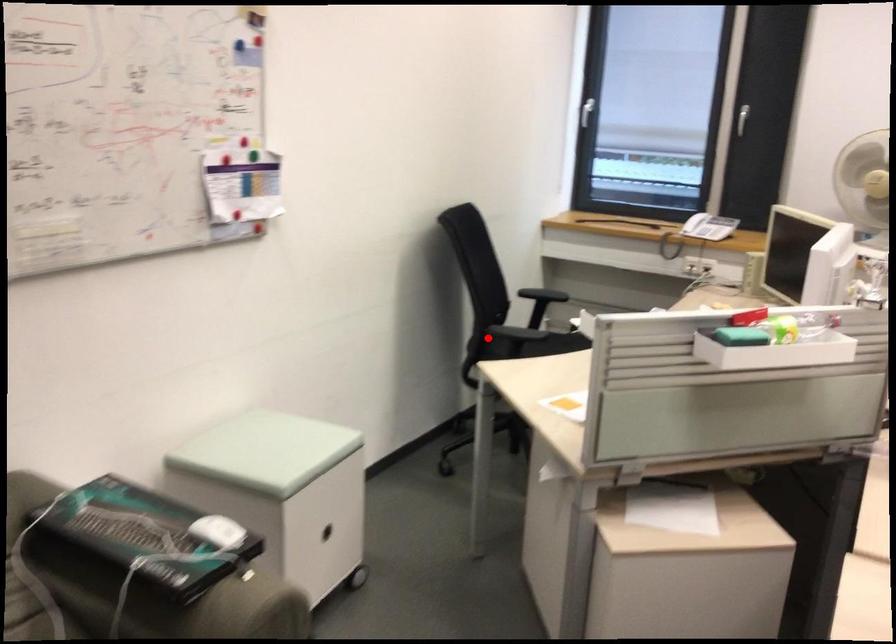
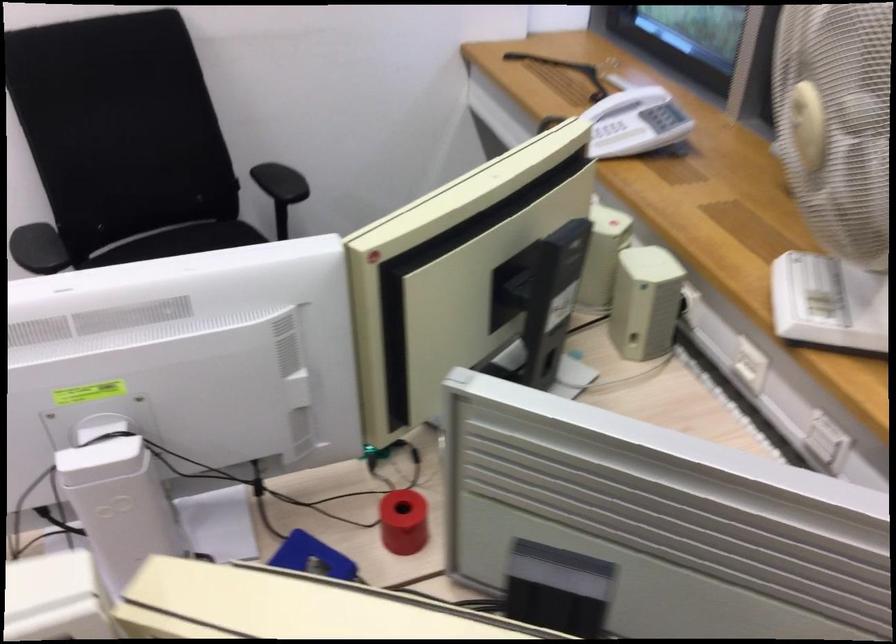
Where in the second image is the point corresponding to the highlighted location from the first image?

(179, 240)